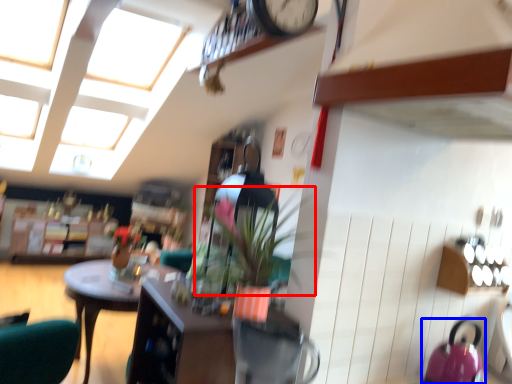
Question: Which object is further to the camera taking this photo, plant (highlighted by a red box) or kettle (highlighted by a blue box)?

Choices:
 (A) plant
 (B) kettle

Answer: (A)